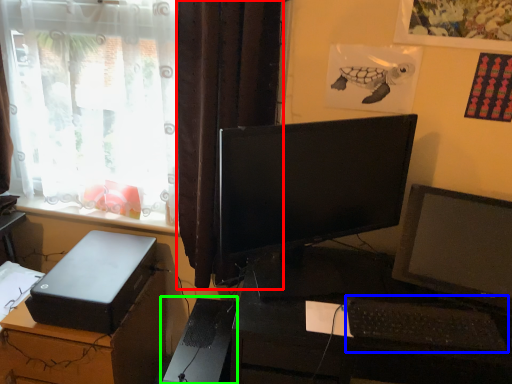
Question: Considering the real-world distances, which object is farthest from curtain (highlighted by a red box)? computer keyboard (highlighted by a blue box) or computer tower (highlighted by a green box)?

Choices:
 (A) computer keyboard
 (B) computer tower

Answer: (A)